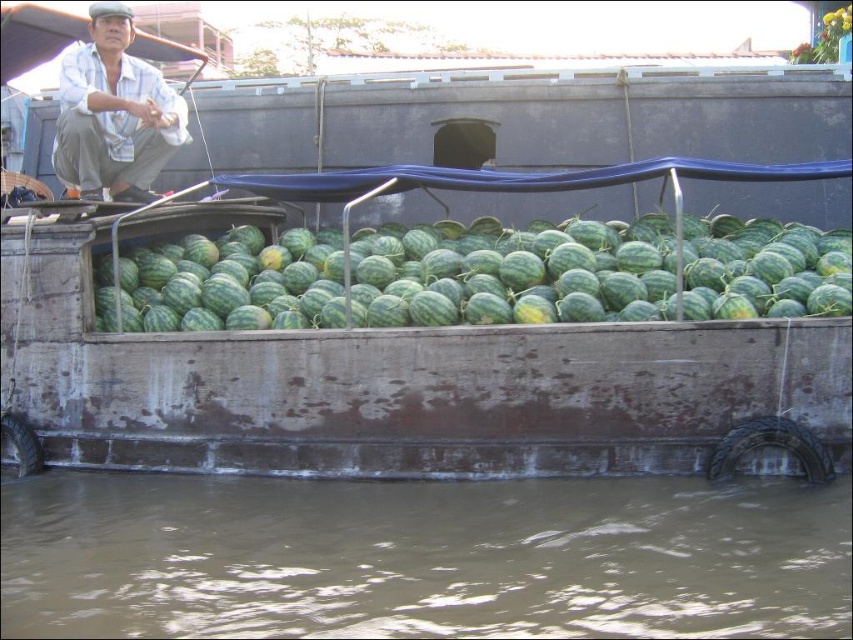
Who is lower down, green matte watermelon at center or white cotton shirt at upper left?

green matte watermelon at center is lower down.

Does green matte watermelon at center have a greater height compared to white cotton shirt at upper left?

In fact, green matte watermelon at center may be shorter than white cotton shirt at upper left.

Between point (772, 282) and point (86, 129), which one is positioned behind?

Positioned behind is point (86, 129).

This screenshot has width=853, height=640. Find the location of `green matte watermelon at center`. green matte watermelon at center is located at coordinates (479, 276).

Does brown murky water at lower center have a smaller size compared to white cotton shirt at upper left?

Indeed, brown murky water at lower center has a smaller size compared to white cotton shirt at upper left.

Which is in front, point (790, 596) or point (102, 28)?

Point (790, 596)

I want to click on brown murky water at lower center, so click(x=421, y=557).

Can you confirm if brown murky water at lower center is shorter than green matte watermelon at center?

Correct, brown murky water at lower center is not as tall as green matte watermelon at center.

Where is `brown murky water at lower center`? brown murky water at lower center is located at coordinates (421, 557).

The image size is (853, 640). In order to click on brown murky water at lower center in this screenshot , I will do `click(421, 557)`.